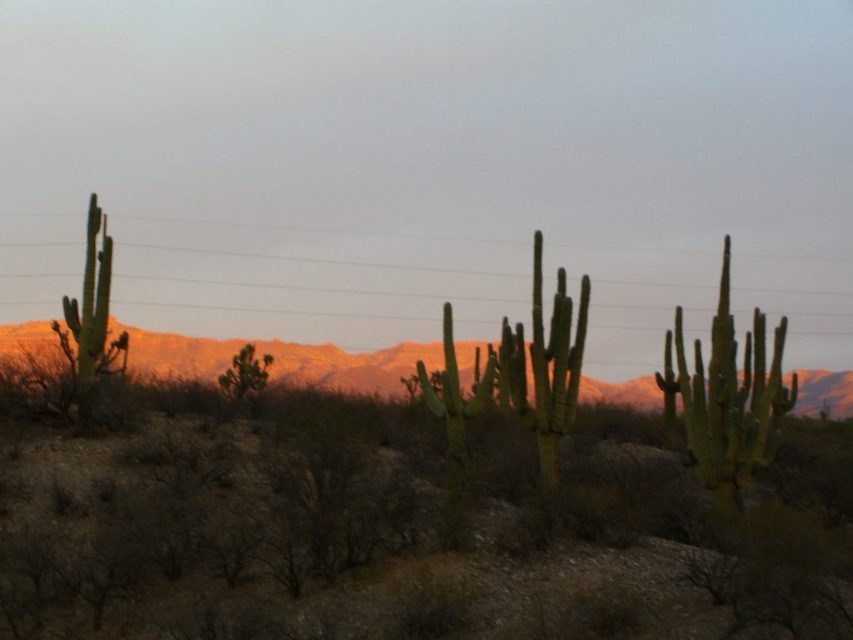
You are an explorer in the desert and see the rustic sandstone mountains at center and the green spiny cactus at right. Which one is located to the left of the other?

The rustic sandstone mountains at center is positioned on the left side of green spiny cactus at right.

You are navigating a drone over the desert and need to locate the rustic sandstone mountains at center. According to the coordinates provided, where exactly should you direct the drone to find them?

The rustic sandstone mountains at center are located at coordinates point (277, 360), so direct the drone to that position to find them.